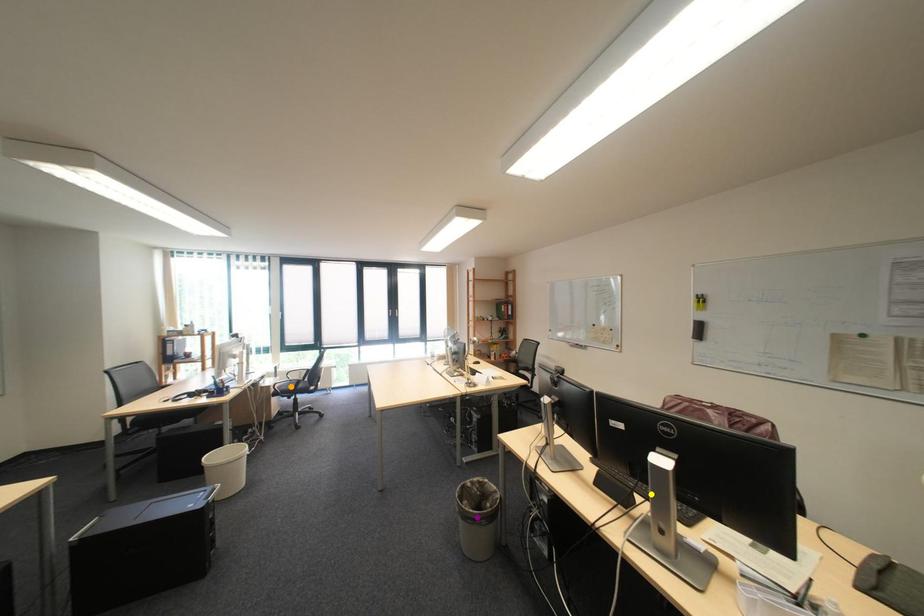
Order these from nearest to farthest:
A) purple point
B) orange point
C) yellow point

yellow point, purple point, orange point